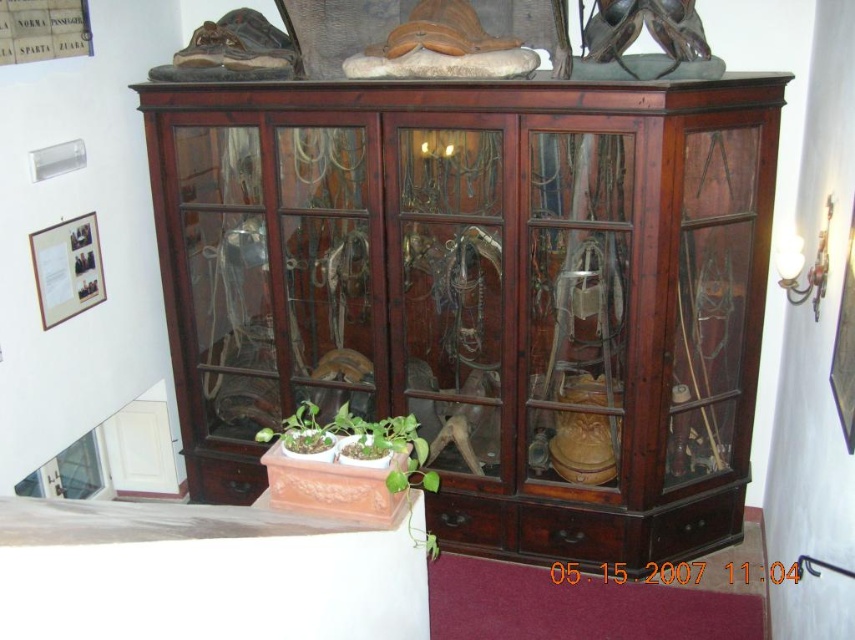
You are an interior designer arranging plants in a room with the wooden display cabinet. You have a green matte pot at lower center and a green matte plant at center. Which object is closer to you when standing in front of the cabinet?

The green matte pot at lower center is closer to you because it is in front of the green matte plant at center.

You are a visitor in a room with the wooden display cabinet. You see the green matte pot at lower center and the green matte plant at center. Which one is positioned higher up?

The green matte pot at lower center is located above the green matte plant at center, so the green matte pot at lower center is positioned higher up.

You are standing in front of the wooden display cabinet and want to place a new item exactly where the green matte pot at lower center is located. What are the coordinates of the spot where you should place the new item?

The coordinates of the spot where the green matte pot at lower center is located are at point [345,461].